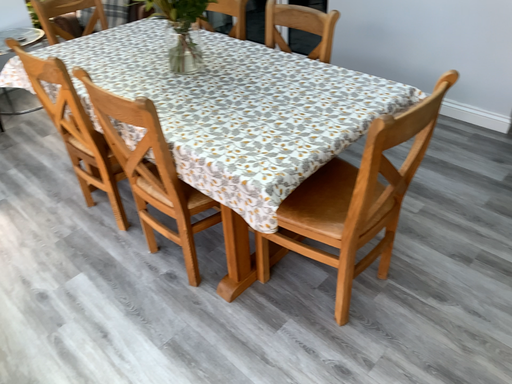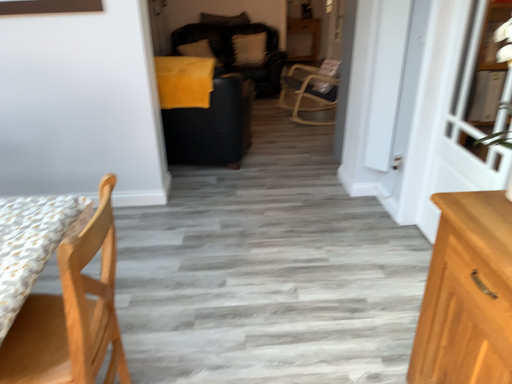
Question: Which way did the camera rotate in the video?

Choices:
 (A) rotated upward
 (B) rotated downward

Answer: (A)